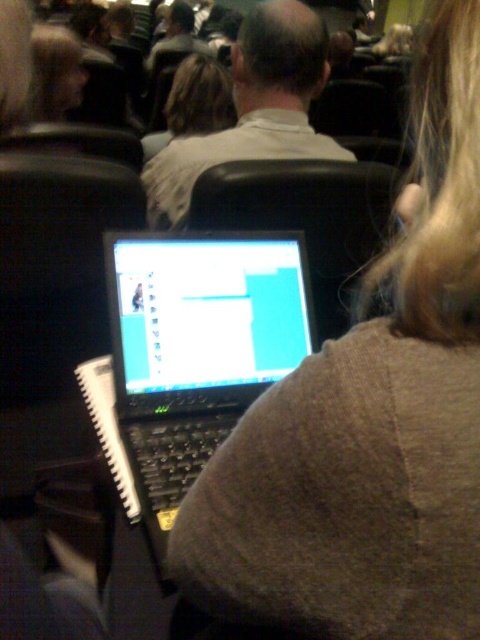
Is matte black laptop at center bigger than blonde hair at upper left?

No, matte black laptop at center is not bigger than blonde hair at upper left.

Is matte black laptop at center taller than blonde hair at upper left?

Incorrect, matte black laptop at center's height is not larger of blonde hair at upper left's.

Which is in front, point (235, 326) or point (52, 109)?

Point (235, 326) is in front.

I want to click on matte black laptop at center, so click(x=205, y=310).

Can you confirm if black plastic laptop at center is positioned to the right of blonde hair at upper left?

Indeed, black plastic laptop at center is positioned on the right side of blonde hair at upper left.

Is the position of black plastic laptop at center less distant than that of blonde hair at upper left?

Yes, it is in front of blonde hair at upper left.

Who is more forward, (136, 419) or (68, 92)?

Point (136, 419) is in front.

At what (x,y) coordinates should I click in order to perform the action: click on black plastic laptop at center. Please return your answer as a coordinate pair (x, y). Looking at the image, I should click on (195, 352).

Is point (275, 310) more distant than point (256, 321)?

Yes, point (275, 310) is farther from viewer.

Does black plastic laptop at center have a smaller size compared to matte black laptop at center?

No.

Between point (298, 364) and point (157, 387), which one is positioned in front?

Point (157, 387)

What are the coordinates of `black plastic laptop at center` in the screenshot? It's located at (195, 352).